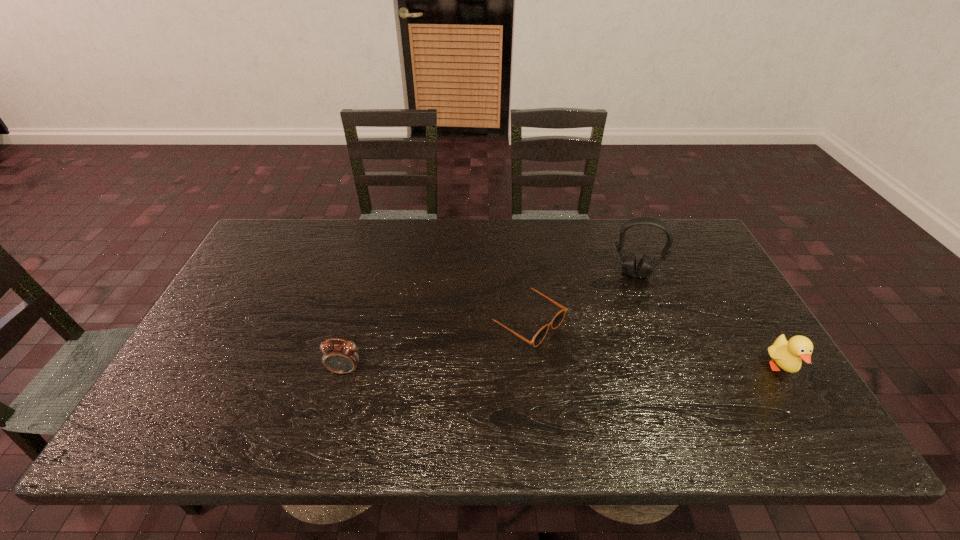
Image resolution: width=960 pixels, height=540 pixels. I want to click on vacant space at the far left corner, so click(x=290, y=254).

The image size is (960, 540). What are the coordinates of `free region at the near right corner of the desktop` in the screenshot? It's located at (750, 382).

The width and height of the screenshot is (960, 540). Find the location of `vacant space in between the rightmost object and the tallest object`. vacant space in between the rightmost object and the tallest object is located at coordinates (708, 321).

This screenshot has height=540, width=960. I want to click on free space between the leftmost object and the rightmost object, so click(x=563, y=369).

The width and height of the screenshot is (960, 540). What are the coordinates of `vacant area that lies between the second object from right to left and the leftmost object` in the screenshot? It's located at (490, 322).

Identify the location of unoccupied area between the rightmost object and the leftmost object. (563, 369).

Locate an element on the screen. The height and width of the screenshot is (540, 960). free spot between the rightmost object and the headset is located at coordinates (708, 321).

Where is `free space between the tallest object and the shortest object`? free space between the tallest object and the shortest object is located at coordinates (580, 297).

I want to click on empty space between the alarm clock and the rightmost object, so click(x=563, y=369).

Find the location of `vacant space that is in between the tallest object and the duckling`. vacant space that is in between the tallest object and the duckling is located at coordinates (708, 321).